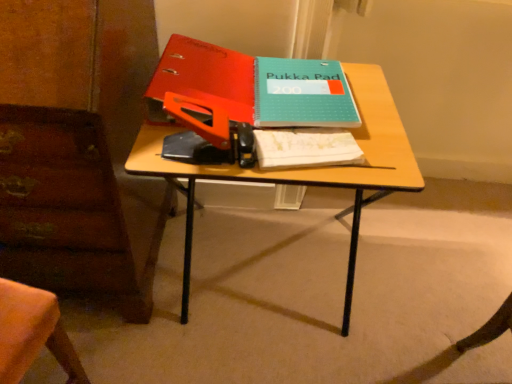
What are the coordinates of `spots to the right of wooden desk at center` in the screenshot? It's located at (403, 294).